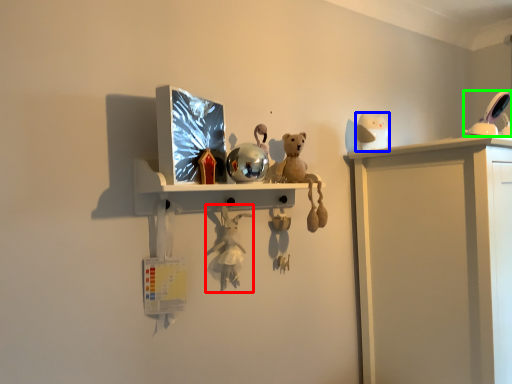
Question: Which is farther away from toy (highlighted by a red box)? toy (highlighted by a blue box) or toy (highlighted by a green box)?

Choices:
 (A) toy
 (B) toy

Answer: (B)